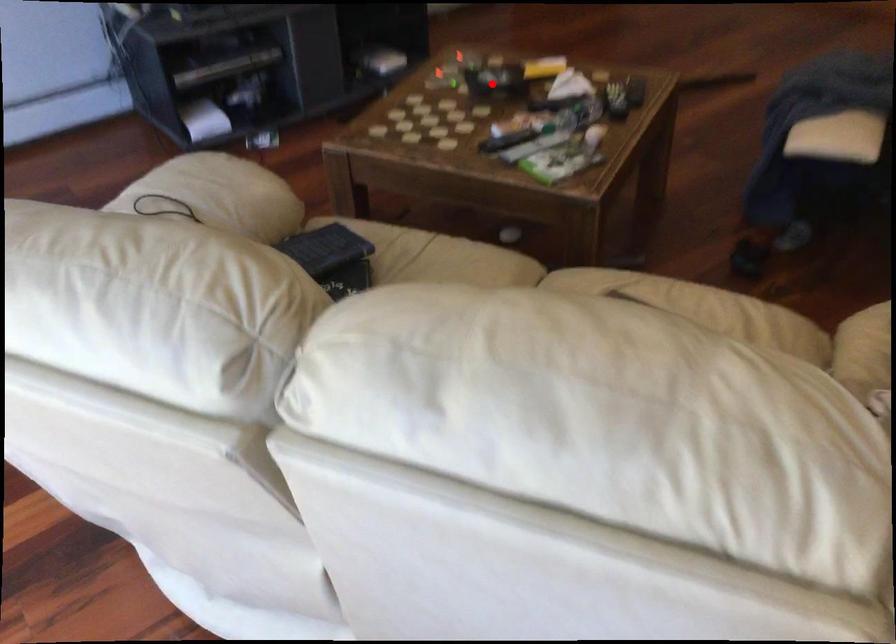
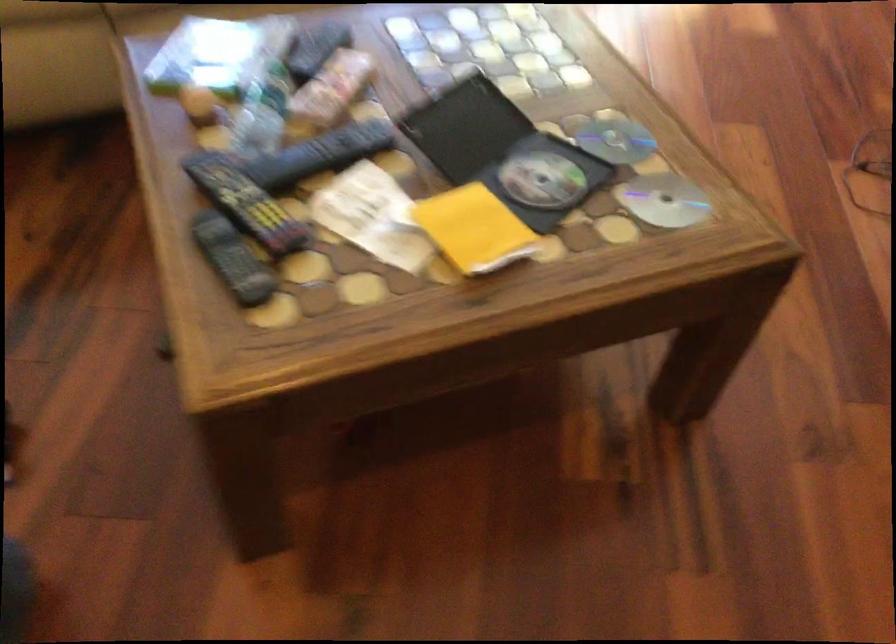
Question: I am providing you with two images of the same scene from different viewpoints. Given a red point in image1, look at the same physical point in image2. Is it:

Choices:
 (A) Closer to the viewpoint
 (B) Farther from the viewpoint

Answer: (A)